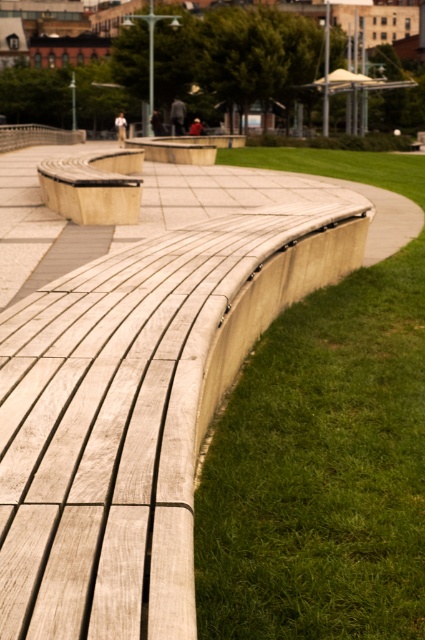
You are planning to place a small garden ornament that requires a 2 square feet area. Given the green grass at lower right and the wooden bench at center, which location would be suitable for placing the ornament?

The green grass at lower right occupies less space than the wooden bench at center, so the wooden bench at center has more space and would be suitable for placing the ornament.

Looking at this image, you are standing at the curved wooden bench in the park. You notice two points marked in the scene. The first point is at coordinate point [260,513] and the second point is at coordinate point [67,189]. Which of these two points is closer to you from your current position at the bench?

Point [260,513] is in front of point [67,189], so the first point is closer to you.